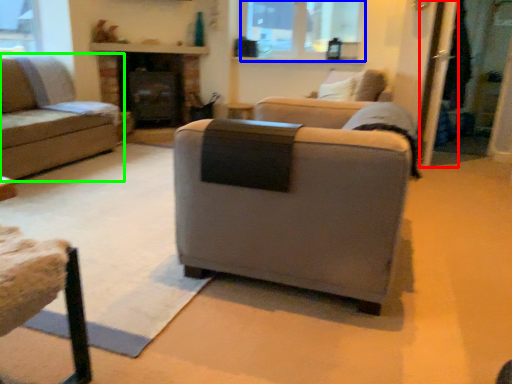
Question: Estimate the real-world distances between objects in this image. Which object is farther from screen door (highlighted by a red box), bay window (highlighted by a blue box) or studio couch (highlighted by a green box)?

Choices:
 (A) bay window
 (B) studio couch

Answer: (B)